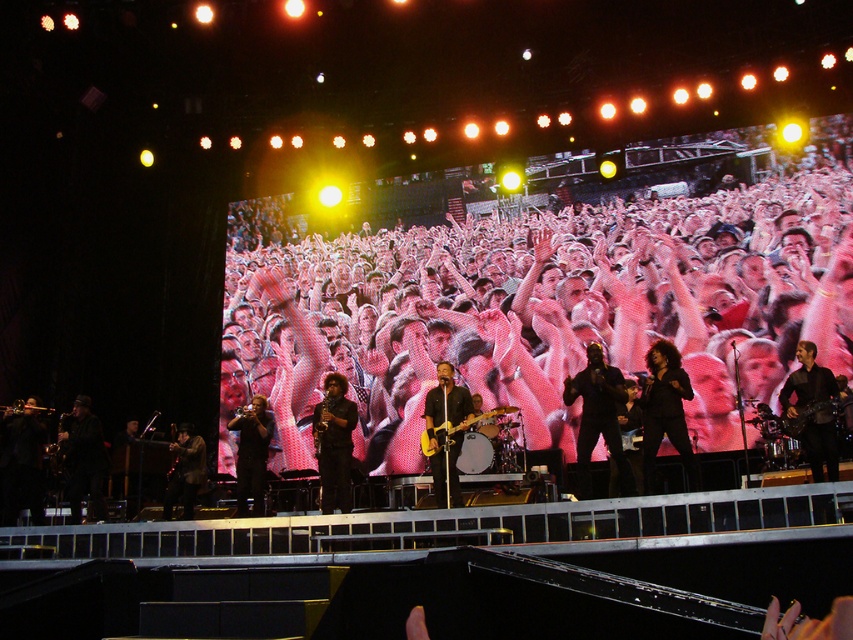
You are a photographer at the concert and want to take a photo of the shiny black guitar at center. The camera you are using has a 50mm lens. If the guitar is located at coordinates point 0.692, 0.393, where should you aim your camera to capture it?

You should aim your camera at point (334, 442) to capture the shiny black guitar at center.

Looking at this image, you are a stage technician who needs to adjust the microphone stands for the two guitars. Since the shiny black guitar at center and the yellow electric guitar at center are both on stage, which one requires a taller microphone stand?

The shiny black guitar at center is taller than the yellow electric guitar at center, so it requires a taller microphone stand.

You are a photographer at the concert and want to capture both the black leather jacket at center and the yellow electric guitar at center in a single shot. Since you can only focus on one object, which one should you choose to ensure the taller object is in focus?

The black leather jacket at center is taller than the yellow electric guitar at center, so you should focus on the black leather jacket at center to ensure the taller object is in focus.